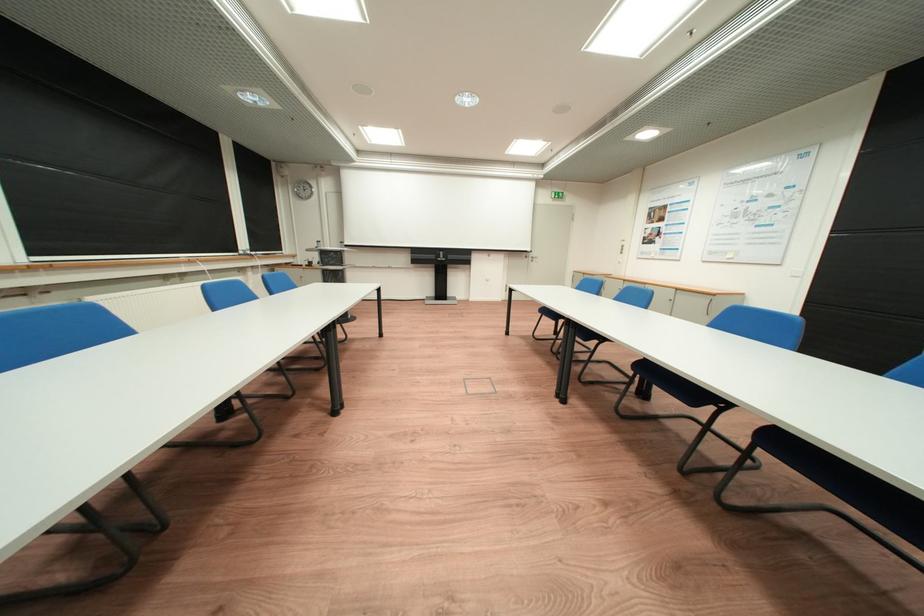
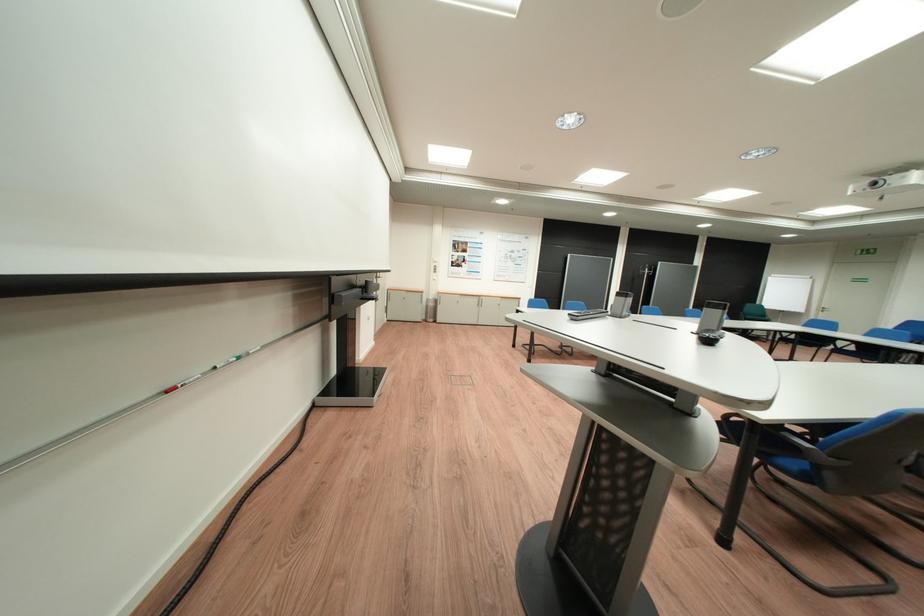
Question: I am providing you with two images of the same scene from different viewpoints. Please identify which objects are invisible in image2.

Choices:
 (A) silver cabinet handle
 (B) red whiteboard marker
 (C) blue chair sitting surface
 (D) silver beverage can

Answer: (C)